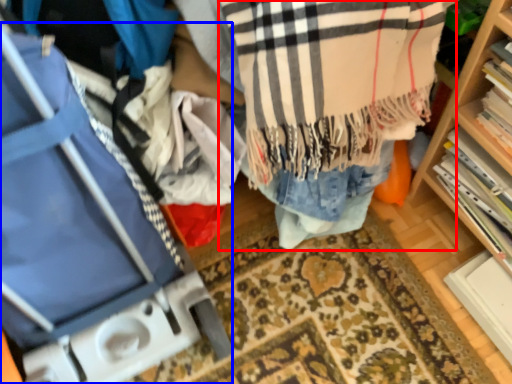
Question: Among these objects, which one is nearest to the camera, clothing (highlighted by a red box) or luggage (highlighted by a blue box)?

Choices:
 (A) clothing
 (B) luggage

Answer: (B)